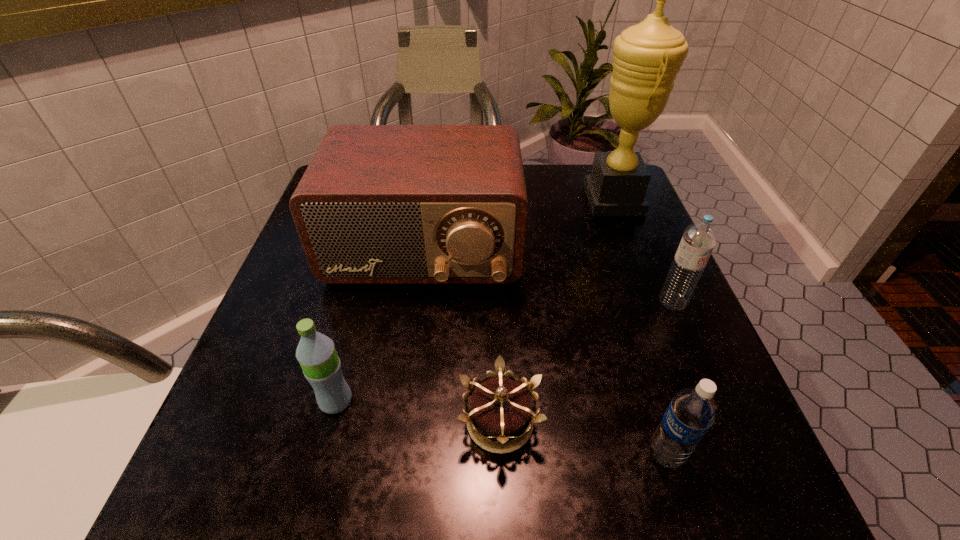
Select which water bottle is the closest to the leftmost water bottle. Please provide its 2D coordinates. Your answer should be formatted as a tuple, i.e. [(x, y)], where the tuple contains the x and y coordinates of a point satisfying the conditions above.

[(693, 410)]

In order to click on the second closest water bottle relative to the second nearest water bottle in this screenshot , I will do `click(699, 238)`.

This screenshot has height=540, width=960. I want to click on free region that satisfies the following two spatial constraints: 1. on the back side of the farthest water bottle; 2. at the front of the trophy cup with handles, so click(x=630, y=200).

Where is `free location that satisfies the following two spatial constraints: 1. on the back side of the second nearest water bottle; 2. on the right side of the rightmost water bottle`? The image size is (960, 540). free location that satisfies the following two spatial constraints: 1. on the back side of the second nearest water bottle; 2. on the right side of the rightmost water bottle is located at coordinates (362, 301).

You are a GUI agent. You are given a task and a screenshot of the screen. Output one action in this format:
    pyautogui.click(x=<x>, y=<y>)
    Task: Click on the vacant space that satisfies the following two spatial constraints: 1. at the front of the trophy cup with handles; 2. on the front side of the shortest object
    Image resolution: width=960 pixels, height=540 pixels.
    Given the screenshot: What is the action you would take?
    pyautogui.click(x=698, y=422)

Where is `vacant region that satisfies the following two spatial constraints: 1. at the front of the rightmost water bottle with handles; 2. on the right side of the tallest object`? vacant region that satisfies the following two spatial constraints: 1. at the front of the rightmost water bottle with handles; 2. on the right side of the tallest object is located at coordinates (652, 301).

Find the location of a particular element. free space that satisfies the following two spatial constraints: 1. at the front of the tallest object with handles; 2. on the right side of the farthest water bottle is located at coordinates coord(652,301).

Locate an element on the screen. vacant region that satisfies the following two spatial constraints: 1. on the front panel of the farthest water bottle; 2. on the left side of the radio receiver is located at coordinates (418, 301).

Locate an element on the screen. vacant area in the image that satisfies the following two spatial constraints: 1. on the front panel of the farthest water bottle; 2. on the left side of the radio receiver is located at coordinates (418, 301).

I want to click on blank space that satisfies the following two spatial constraints: 1. on the front panel of the radio receiver; 2. on the left side of the nearest water bottle, so click(396, 454).